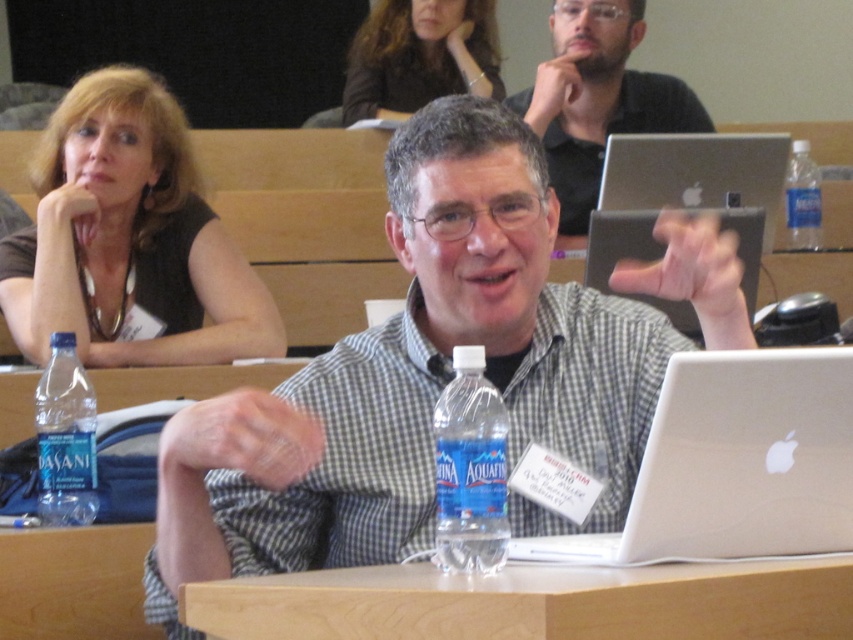
Question: Which object is positioned closest to the silver metallic laptop at center?

Choices:
 (A) matte black laptop at upper center
 (B) matte black shirt at upper left
 (C) checkered fabric shirt at center
 (D) light brown wood table at center

Answer: (D)

Question: Is dark brown hair at upper center smaller than blue translucent water bottle at center?

Choices:
 (A) yes
 (B) no

Answer: (B)

Question: Does checkered fabric shirt at center have a smaller size compared to blue translucent water bottle at center?

Choices:
 (A) no
 (B) yes

Answer: (A)

Question: Which of the following is the closest to the observer?

Choices:
 (A) light brown wood table at center
 (B) matte black laptop at upper center
 (C) clear plastic water bottle at upper right

Answer: (A)

Question: Where is matte black shirt at upper left located in relation to clear plastic bottle at left in the image?

Choices:
 (A) below
 (B) above

Answer: (B)

Question: Considering the real-world distances, which object is closest to the light brown wood table at center?

Choices:
 (A) dark brown hair at upper center
 (B) blue translucent water bottle at center
 (C) checkered fabric shirt at center

Answer: (B)